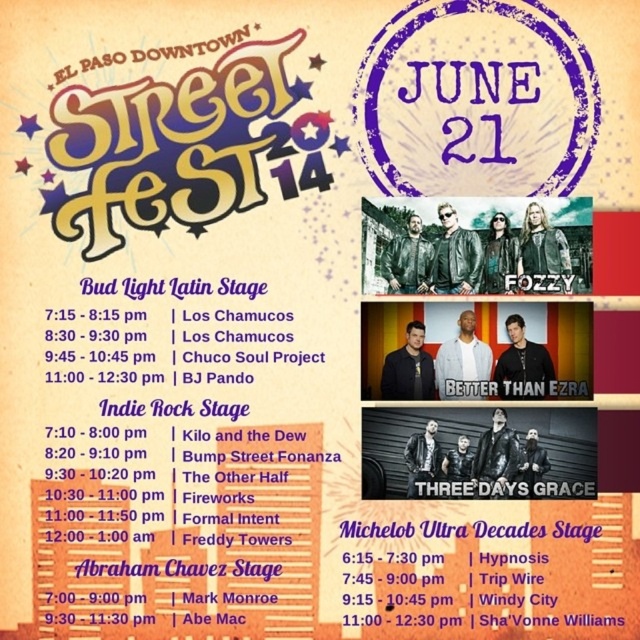
You are at the El Paso Downtown Street Fest 14 and want to find the purple paper stage at center. Which direction should you look relative to the michelob ultra decades stage at center?

The purple paper stage at center is to the left of the michelob ultra decades stage at center, so you should look to the left of the michelob ultra decades stage at center to find it.

You are a festival attendee holding a 30 cm wide poster. You want to place it between the michelob ultra decades stage at center and the blacktexturedbetter than ezra at center. Can the poster fit in the space between them?

The space between the michelob ultra decades stage at center and the blacktexturedbetter than ezra at center is 37.29 centimeters. Since the poster is 30 cm wide, it can fit in the space between them.